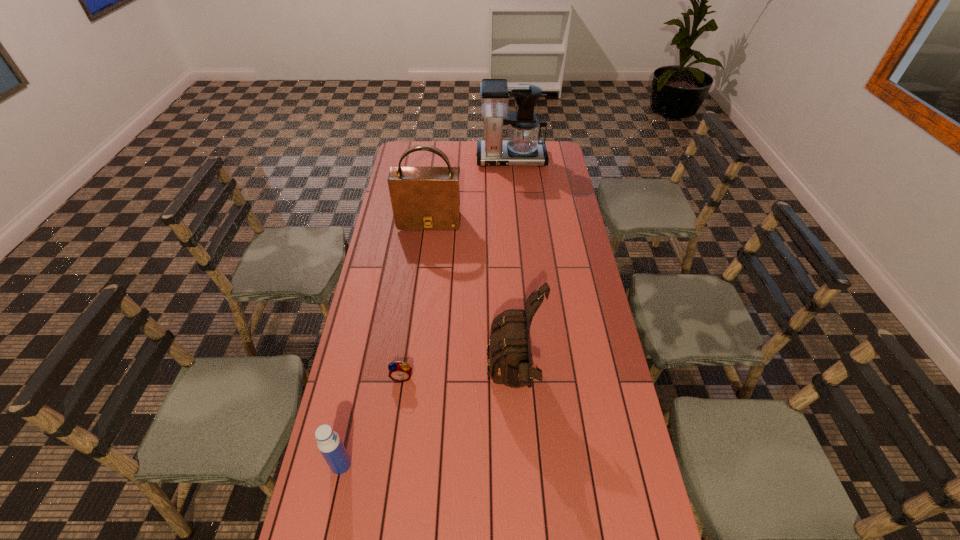
The width and height of the screenshot is (960, 540). What are the coordinates of `free space located on the front-facing side of the nearer shoulder bag` in the screenshot? It's located at (419, 382).

The image size is (960, 540). I want to click on vacant space located 0.150m on the front-facing side of the nearer shoulder bag, so click(x=438, y=382).

The image size is (960, 540). I want to click on blank space located 0.390m on the right of the fourth tallest object, so click(x=495, y=464).

Identify the location of vacant point located on the front-facing side of the shortest object. (383, 512).

This screenshot has height=540, width=960. What are the coordinates of `object that is at the far edge` in the screenshot? It's located at (523, 148).

Image resolution: width=960 pixels, height=540 pixels. Find the location of `shoulder bag present at the left edge`. shoulder bag present at the left edge is located at coordinates (423, 197).

The width and height of the screenshot is (960, 540). What are the coordinates of `water bottle located at the left edge` in the screenshot? It's located at (329, 443).

Where is `alarm clock that is at the left edge`? alarm clock that is at the left edge is located at coordinates (401, 371).

Where is `object that is at the right edge`? The height and width of the screenshot is (540, 960). object that is at the right edge is located at coordinates 523,148.

Locate an element on the screen. This screenshot has height=540, width=960. object present at the far right corner is located at coordinates (523, 148).